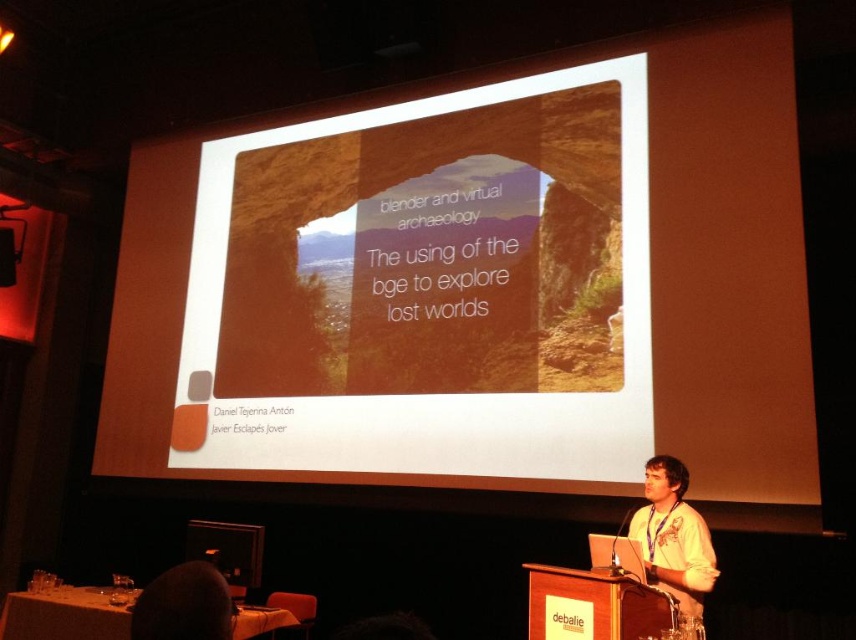
Question: In this image, where is matte orange slide at center located relative to white shirt at center?

Choices:
 (A) right
 (B) left

Answer: (B)

Question: Among these objects, which one is nearest to the camera?

Choices:
 (A) dark hair at lower left
 (B) matte orange slide at center
 (C) white shirt at center

Answer: (A)

Question: Which of the following is the farthest from the observer?

Choices:
 (A) matte orange slide at center
 (B) dark hair at lower left

Answer: (A)

Question: Which object is the closest to the matte orange slide at center?

Choices:
 (A) white shirt at center
 (B) dark hair at lower left

Answer: (A)

Question: From the image, what is the correct spatial relationship of matte orange slide at center in relation to dark hair at lower left?

Choices:
 (A) below
 (B) above

Answer: (A)

Question: Can you confirm if matte orange slide at center is positioned below dark hair at lower left?

Choices:
 (A) yes
 (B) no

Answer: (A)